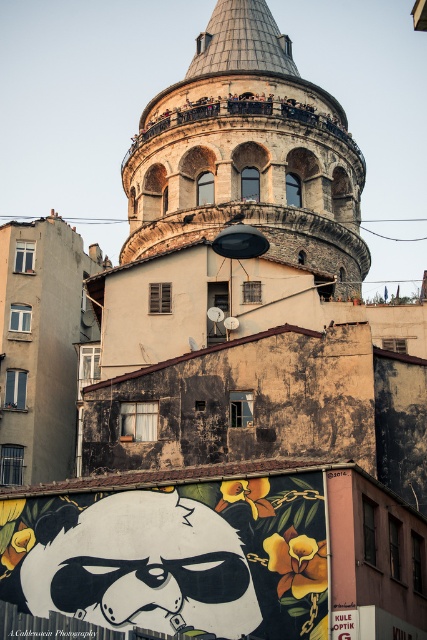
You are an architect visiting the city and want to take a photo of both the black glossy panda at lower center and the stone tower at center in the same frame. Considering their sizes, which object should you focus on first to ensure both are visible in the photo?

The black glossy panda at lower center is smaller than the stone tower at center, so you should focus on the stone tower at center first to ensure both are visible in the photo.